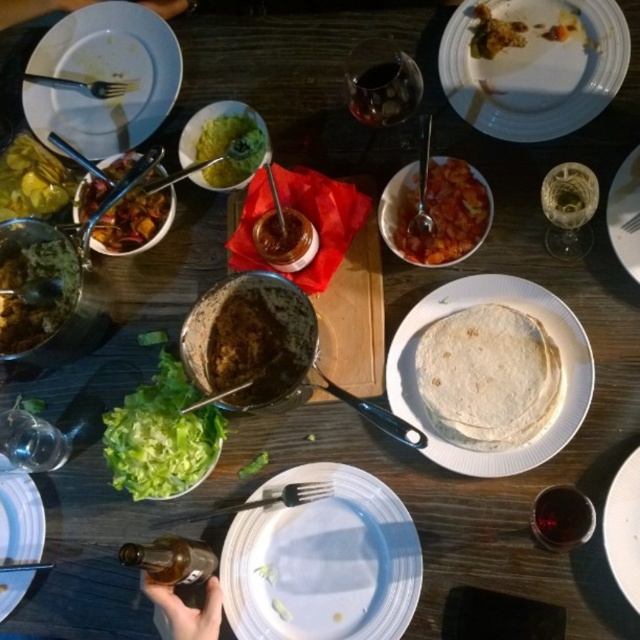
You are sitting at the communal dining table and want to reach both the point at coordinates (42, 308) and the point at coordinates (3, 564). Which point is closer to you?

The point at coordinates (42, 308) is closer to you because it is further to the viewer than the point at coordinates (3, 564).

You are a server who needs to place a 28 inch long platter on the table. You see the transparent glass at upper center and the white matte plate at lower left. Can you fit the platter between them without moving any existing items?

The distance between the transparent glass at upper center and the white matte plate at lower left is 30.58 inches. Since the platter is 28 inches long, it can fit between them as there is enough space.